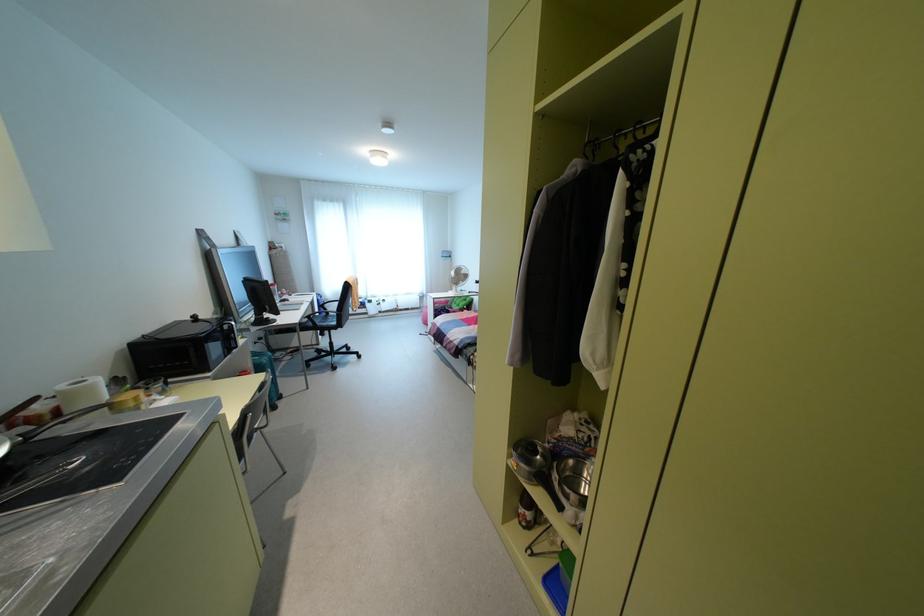
Image resolution: width=924 pixels, height=616 pixels. I want to click on chair sitting surface, so click(322, 317).